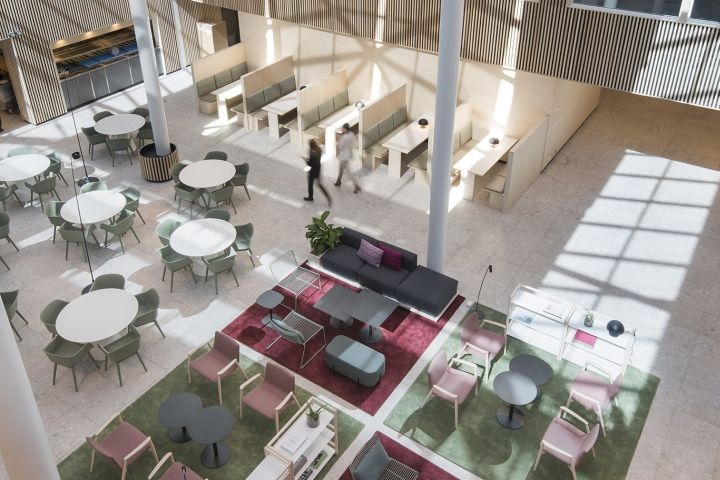
Where is `narrow table`? narrow table is located at coordinates (232, 92), (281, 104), (348, 115), (413, 134), (485, 157).